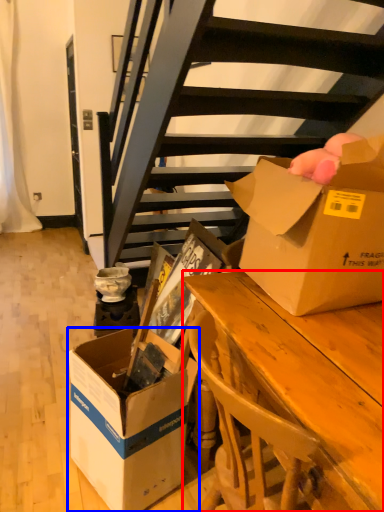
Question: Which point is closer to the camera, desk (highlighted by a red box) or box (highlighted by a blue box)?

Choices:
 (A) desk
 (B) box

Answer: (A)